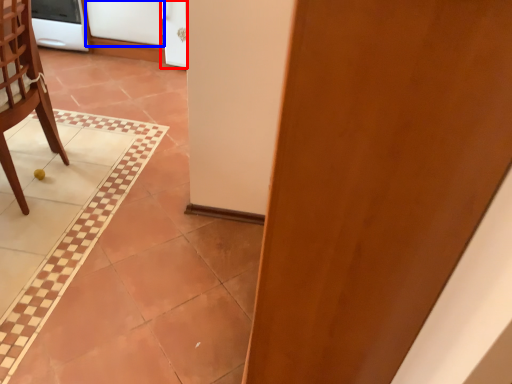
Question: Which point is further to the camera, screen door (highlighted by a red box) or screen door (highlighted by a blue box)?

Choices:
 (A) screen door
 (B) screen door

Answer: (B)